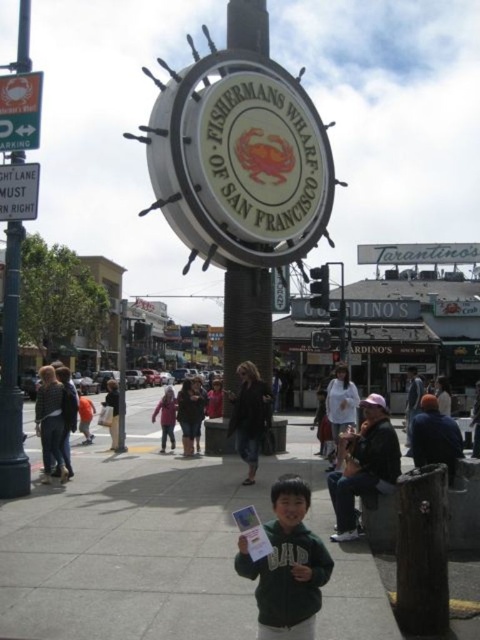
Which is more to the right, dark blue jacket at lower right or metal sign at left?

dark blue jacket at lower right

Can you confirm if dark blue jacket at lower right is taller than metal sign at left?

Correct, dark blue jacket at lower right is much taller as metal sign at left.

You are a GUI agent. You are given a task and a screenshot of the screen. Output one action in this format:
    pyautogui.click(x=<x>, y=<y>)
    Task: Click on the dark blue jacket at lower right
    
    Given the screenshot: What is the action you would take?
    pyautogui.click(x=434, y=436)

Between smooth gray pole at center and metal sign at left, which one has more height?

smooth gray pole at center is taller.

How far apart are smooth gray pole at center and metal sign at left?

A distance of 66.58 feet exists between smooth gray pole at center and metal sign at left.

Does point (242, 13) come behind point (33, 176)?

Yes, it is.

In order to click on smooth gray pole at center in this screenshot , I will do `click(247, 321)`.

Who is shorter, gray concrete sidewalk at center or smooth gray pole at center?

gray concrete sidewalk at center is shorter.

Is gray concrete sidewalk at center below smooth gray pole at center?

Yes, gray concrete sidewalk at center is below smooth gray pole at center.

Is point (333, 552) positioned in front of point (253, 36)?

That is True.

The image size is (480, 640). Identify the location of gray concrete sidewalk at center. (165, 547).